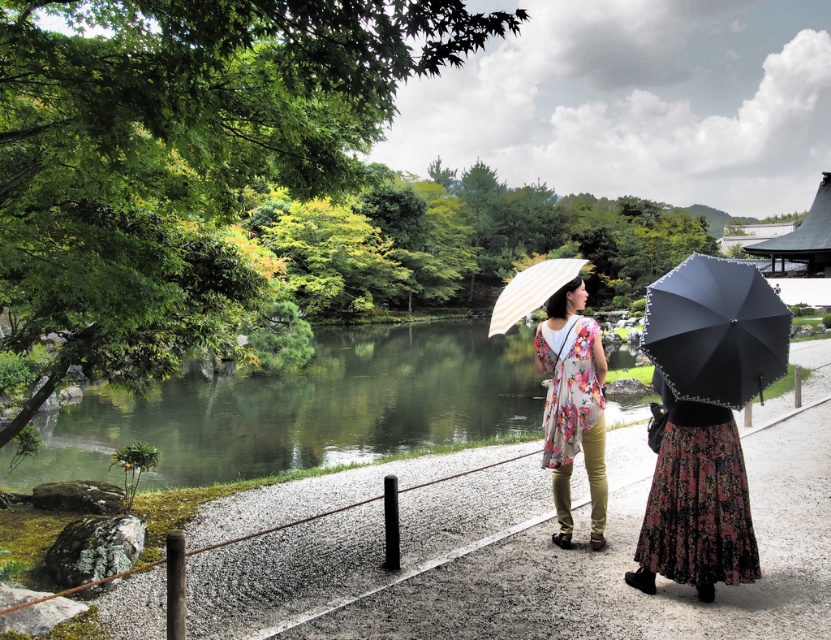
You are a photographer positioned at the edge of the gravel path, aiming to capture the two subjects in the scene. The subjects are wearing a floral fabric dress at center and holding a white striped fabric umbrella at center. Based on their positions, which subject is closer to the left side of your camera frame?

The floral fabric dress at center is to the left of the white striped fabric umbrella at center, so the subject wearing the floral fabric dress at center is closer to the left side of the camera frame.